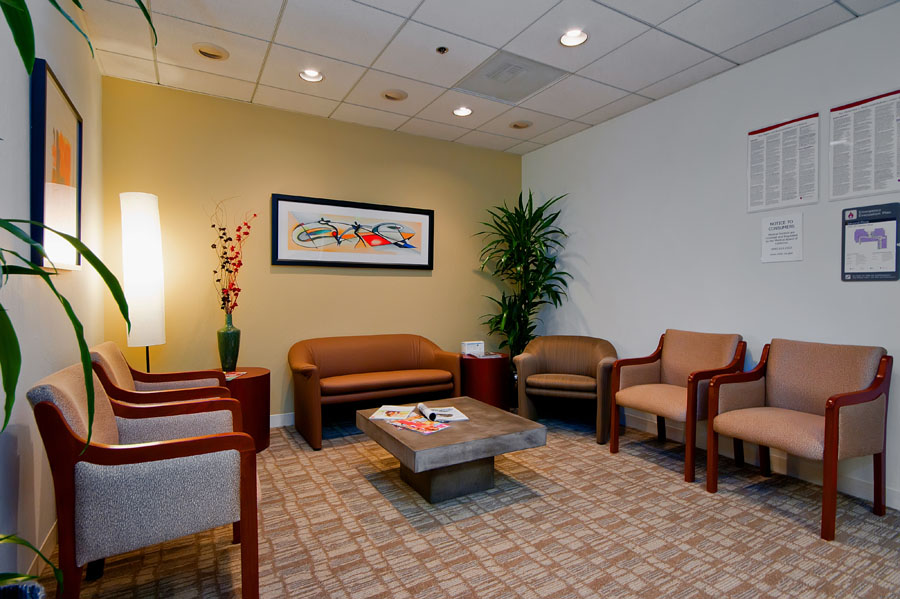
The height and width of the screenshot is (599, 900). I want to click on ceiling lights that are on, so click(x=309, y=74), click(x=461, y=110), click(x=570, y=35).